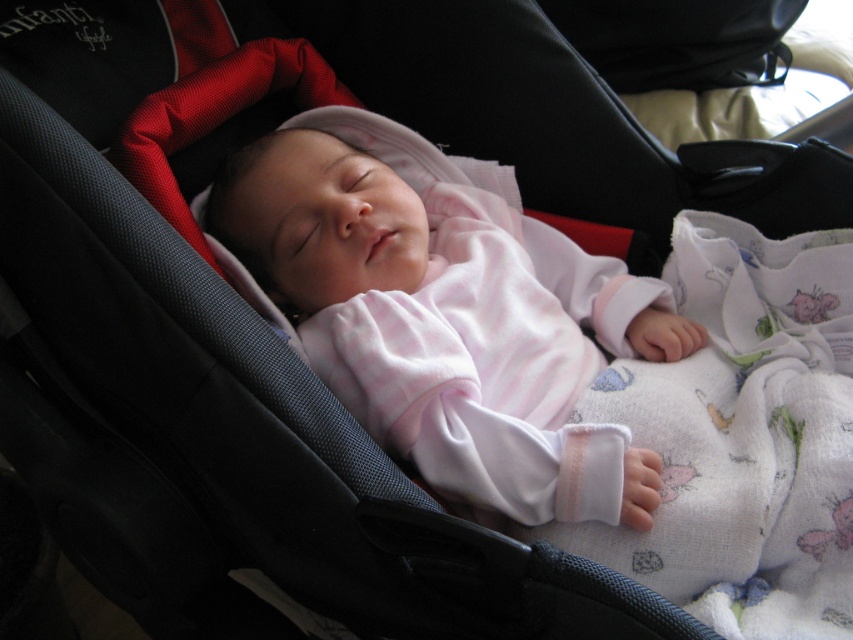
Question: Is pink soft fabric baby at center positioned before white cotton blanket at lower right?

Choices:
 (A) yes
 (B) no

Answer: (B)

Question: Among these objects, which one is nearest to the camera?

Choices:
 (A) white cotton blanket at lower right
 (B) pink soft fabric baby at center

Answer: (A)

Question: Can you confirm if pink soft fabric baby at center is positioned above white cotton blanket at lower right?

Choices:
 (A) no
 (B) yes

Answer: (B)

Question: Is pink soft fabric baby at center below white cotton blanket at lower right?

Choices:
 (A) no
 (B) yes

Answer: (A)

Question: Which of the following is the closest to the observer?

Choices:
 (A) pink soft fabric baby at center
 (B) white cotton blanket at lower right

Answer: (B)